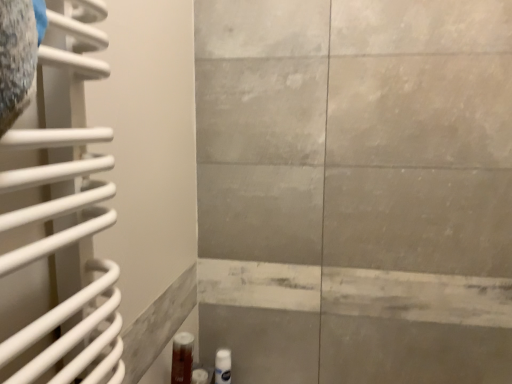
Image resolution: width=512 pixels, height=384 pixels. Describe the element at coordinates (223, 366) in the screenshot. I see `white glossy bottle at lower center` at that location.

Where is `white glossy bottle at lower center`? white glossy bottle at lower center is located at coordinates (223, 366).

The width and height of the screenshot is (512, 384). In order to click on white glossy bottle at lower center in this screenshot , I will do `click(223, 366)`.